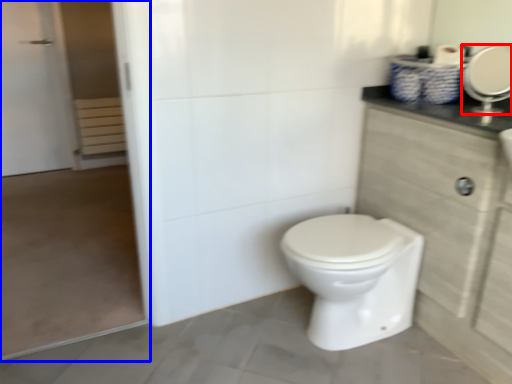
Question: Which of the following is the farthest to the observer, mirror (highlighted by a red box) or screen door (highlighted by a blue box)?

Choices:
 (A) mirror
 (B) screen door

Answer: (A)